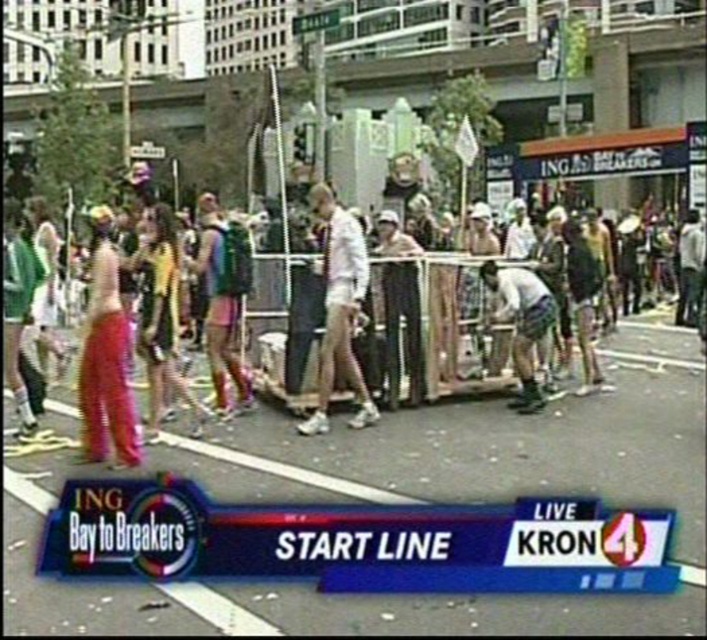
Question: Which is nearer to the white cotton shirt at center?

Choices:
 (A) shiny pink fabric at left
 (B) multicolored fabric at center

Answer: (B)

Question: Does shiny pink fabric at left have a larger size compared to white cotton shirt at center?

Choices:
 (A) yes
 (B) no

Answer: (A)

Question: Is shiny pink fabric at left thinner than white cotton shirt at center?

Choices:
 (A) no
 (B) yes

Answer: (A)

Question: Is shiny pink fabric at left bigger than multicolored fabric at center?

Choices:
 (A) yes
 (B) no

Answer: (B)

Question: Which point is closer to the camera taking this photo?

Choices:
 (A) (334, 333)
 (B) (129, 403)
 (C) (312, 401)

Answer: (B)

Question: Which of the following is the farthest from the observer?

Choices:
 (A) (279, 256)
 (B) (321, 200)
 (C) (110, 412)

Answer: (A)